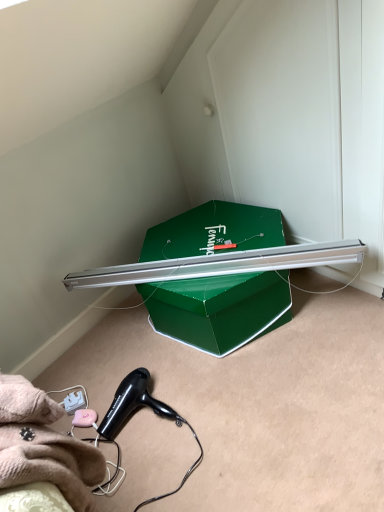
Where is `empty space that is ontop of green cardboard box at center`? The image size is (384, 512). empty space that is ontop of green cardboard box at center is located at coordinates (211, 240).